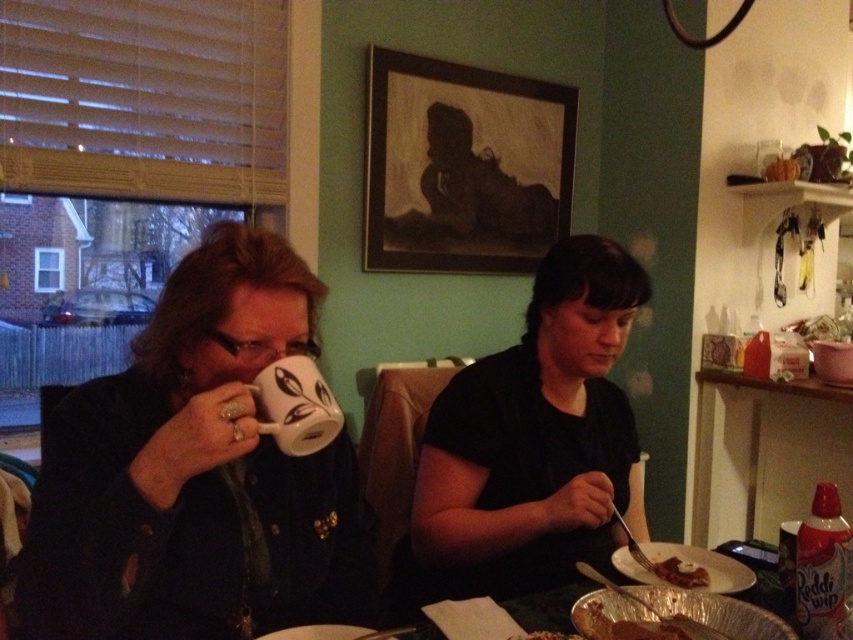
Question: Considering the real-world distances, which object is farthest from the red matte whipped cream at lower right?

Choices:
 (A) metallic silver tray at right
 (B) white glossy mug at upper left
 (C) black matte shirt at center
 (D) white glossy mug at upper center

Answer: (A)

Question: Does black matte shirt at center have a lesser width compared to red matte whipped cream at lower right?

Choices:
 (A) no
 (B) yes

Answer: (A)

Question: Which object is closer to the camera taking this photo?

Choices:
 (A) black matte shirt at center
 (B) white glossy mug at upper center
 (C) red matte whipped cream at lower right
 (D) shiny silver fork at lower right

Answer: (B)

Question: From the image, what is the correct spatial relationship of white glossy mug at upper left in relation to red matte whipped cream at lower right?

Choices:
 (A) below
 (B) above

Answer: (B)

Question: Is white glossy mug at upper center thinner than shiny silver fork at lower right?

Choices:
 (A) no
 (B) yes

Answer: (A)

Question: Which point is farther from the camera taking this photo?

Choices:
 (A) (608, 330)
 (B) (312, 429)
 (C) (839, 454)

Answer: (C)